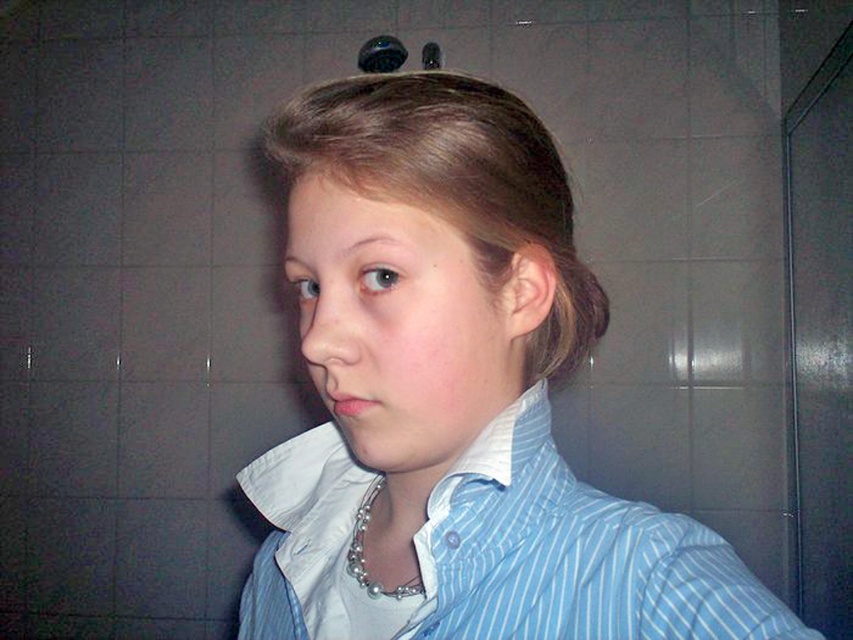
Question: Can you confirm if blue striped shirt at center is wider than silver metallic necklace at center?

Choices:
 (A) no
 (B) yes

Answer: (B)

Question: Which point appears farthest from the camera in this image?

Choices:
 (A) (525, 161)
 (B) (360, 502)

Answer: (B)

Question: Among these objects, which one is farthest from the camera?

Choices:
 (A) slightly shiny brown hair at ear
 (B) blue striped shirt at center

Answer: (A)

Question: Does blue striped shirt at center have a lesser width compared to silver metallic necklace at center?

Choices:
 (A) yes
 (B) no

Answer: (B)

Question: Based on their relative distances, which object is farther from the blonde smooth hair at center?

Choices:
 (A) blue striped shirt at center
 (B) silver metallic necklace at center
 (C) slightly shiny brown hair at ear

Answer: (B)

Question: Can you confirm if blue striped dress shirt at center is positioned to the left of slightly shiny brown hair at ear?

Choices:
 (A) no
 (B) yes

Answer: (B)